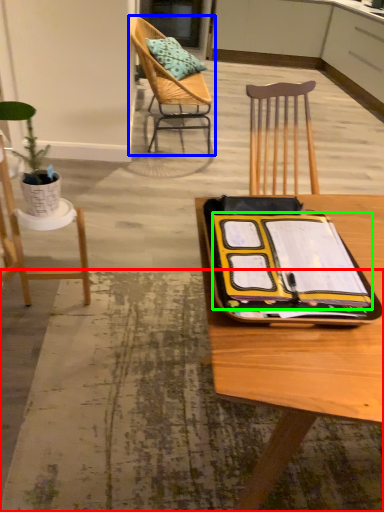
Question: Based on their relative distances, which object is nearer to place mat (highlighted by a red box)? Choose from chair (highlighted by a blue box) and notebook (highlighted by a green box).

Choices:
 (A) chair
 (B) notebook

Answer: (B)